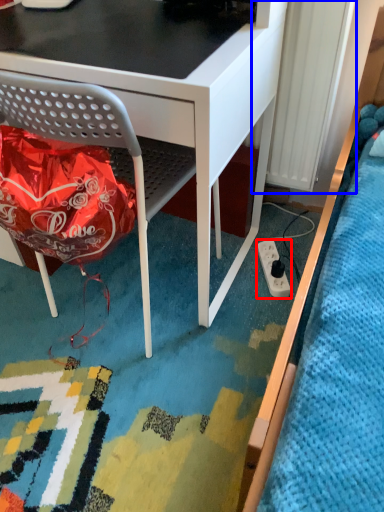
Question: Among these objects, which one is nearest to the camera, power plugs and sockets (highlighted by a red box) or radiator (highlighted by a blue box)?

Choices:
 (A) power plugs and sockets
 (B) radiator

Answer: (B)